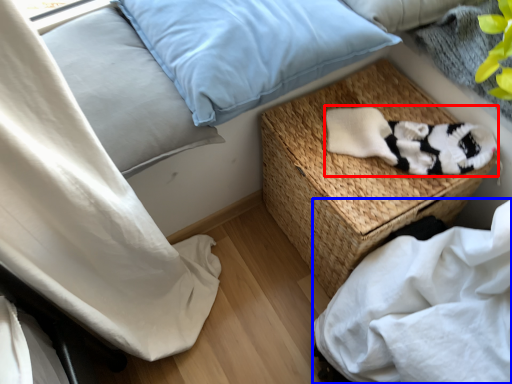
Question: Among these objects, which one is nearest to the camera, material (highlighted by a red box) or sheet (highlighted by a blue box)?

Choices:
 (A) material
 (B) sheet

Answer: (B)